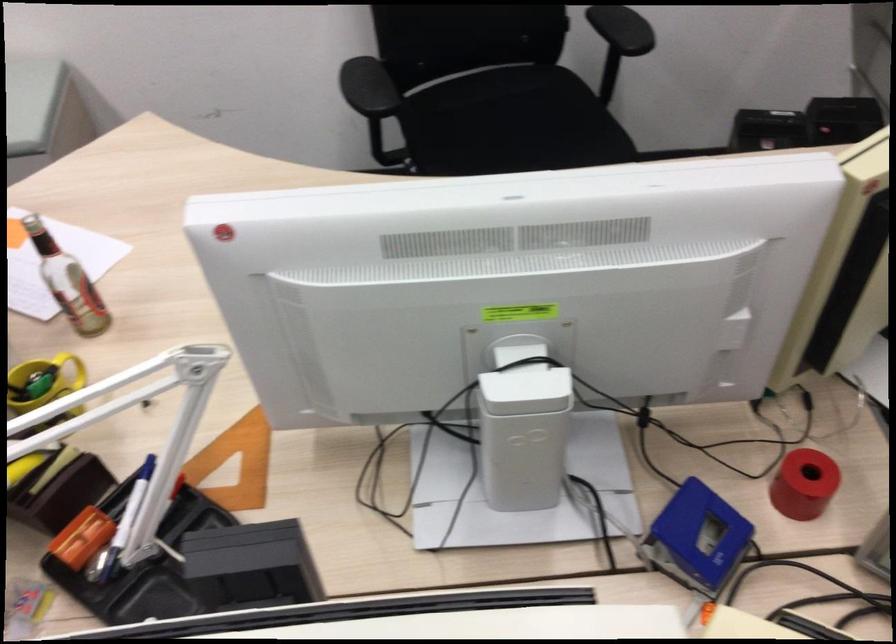
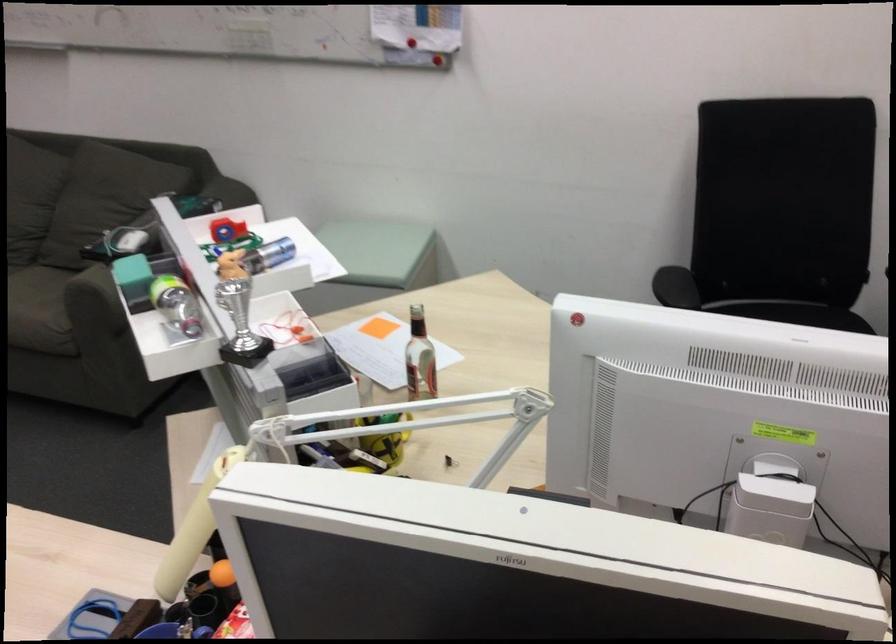
In the second image, find the point that corresponds to point 375,100 in the first image.

(675, 287)